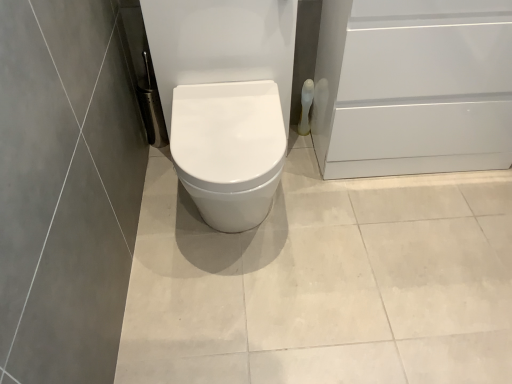
Locate an element on the screen. The width and height of the screenshot is (512, 384). white glossy toilet paper at right is located at coordinates (306, 106).

In order to face white glossy toilet paper at right, should I rotate leftwards or rightwards?

Rotate right and turn 6.754 degrees.

This screenshot has width=512, height=384. What do you see at coordinates (306, 106) in the screenshot?
I see `white glossy toilet paper at right` at bounding box center [306, 106].

Describe the element at coordinates (413, 87) in the screenshot. The image size is (512, 384). I see `white glossy screen door at right` at that location.

What are the coordinates of `white glossy screen door at right` in the screenshot? It's located at point(413,87).

Where is `white glossy toilet paper at right`? This screenshot has height=384, width=512. white glossy toilet paper at right is located at coordinates (306, 106).

Is white glossy toilet paper at right to the right of white glossy screen door at right from the viewer's perspective?

No, white glossy toilet paper at right is not to the right of white glossy screen door at right.

In the image, is white glossy toilet paper at right positioned in front of or behind white glossy screen door at right?

white glossy toilet paper at right is behind white glossy screen door at right.

Does point (303, 126) come in front of point (442, 116)?

That is False.

From the image's perspective, which is above, white glossy toilet paper at right or white glossy screen door at right?

white glossy screen door at right appears higher in the image.

From a real-world perspective, who is located higher, white glossy toilet paper at right or white glossy screen door at right?

In real-world perspective, white glossy screen door at right is above.

Looking at their sizes, would you say white glossy toilet paper at right is wider or thinner than white glossy screen door at right?

Clearly, white glossy toilet paper at right has less width compared to white glossy screen door at right.

Does white glossy toilet paper at right have a lesser height compared to white glossy screen door at right?

Yes, white glossy toilet paper at right is shorter than white glossy screen door at right.

Who is bigger, white glossy toilet paper at right or white glossy screen door at right?

Bigger between the two is white glossy screen door at right.

Which is correct: white glossy toilet paper at right is inside white glossy screen door at right, or outside of it?

white glossy toilet paper at right is not enclosed by white glossy screen door at right.

Can you see white glossy toilet paper at right touching white glossy screen door at right?

No, white glossy toilet paper at right is not touching white glossy screen door at right.

Is white glossy screen door at right at the back of white glossy toilet paper at right?

white glossy toilet paper at right is not turned away from white glossy screen door at right.

Identify the location of toilet paper lying below the white glossy screen door at right (from the image's perspective). (306, 106).

Based on their positions, is white glossy screen door at right located to the left or right of white glossy toilet paper at right?

From the image, it's evident that white glossy screen door at right is to the right of white glossy toilet paper at right.

Which object is closer to the camera taking this photo, white glossy screen door at right or white glossy toilet paper at right?

white glossy screen door at right is more forward.

Does point (349, 128) come behind point (305, 113)?

No, (349, 128) is closer to viewer.

From the image's perspective, who appears lower, white glossy screen door at right or white glossy toilet paper at right?

white glossy toilet paper at right appears lower in the image.

From a real-world perspective, is white glossy screen door at right positioned over white glossy toilet paper at right based on gravity?

Yes.

Which object is wider, white glossy screen door at right or white glossy toilet paper at right?

white glossy screen door at right is wider.

Can you confirm if white glossy screen door at right is taller than white glossy toilet paper at right?

Yes, white glossy screen door at right is taller than white glossy toilet paper at right.

Is white glossy screen door at right bigger than white glossy toilet paper at right?

Correct, white glossy screen door at right is larger in size than white glossy toilet paper at right.

Would you say white glossy toilet paper at right is part of white glossy screen door at right's contents?

Actually, white glossy toilet paper at right is outside white glossy screen door at right.

Is white glossy screen door at right beside white glossy toilet paper at right?

white glossy screen door at right and white glossy toilet paper at right are clearly separated.

Does white glossy screen door at right turn towards white glossy toilet paper at right?

No, white glossy screen door at right is not facing towards white glossy toilet paper at right.

Identify the location of screen door that is on the right side of white glossy toilet paper at right. (413, 87).

The width and height of the screenshot is (512, 384). Identify the location of toilet paper below the white glossy screen door at right (from a real-world perspective). (306, 106).

Locate an element on the screen. The width and height of the screenshot is (512, 384). toilet paper on the left of white glossy screen door at right is located at coordinates (306, 106).